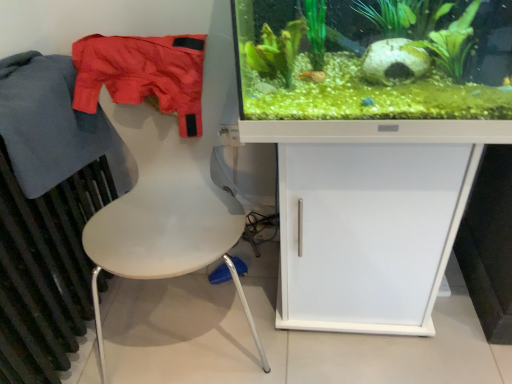
Question: Should I look upward or downward to see green matte plant at upper center?

Choices:
 (A) down
 (B) up

Answer: (B)

Question: Is white matte chair at left behind blue cotton jacket at left, the 1th clothing positioned from the left?

Choices:
 (A) yes
 (B) no

Answer: (B)

Question: Is white matte chair at left far away from blue cotton jacket at left, which appears as the 2th clothing when viewed from the right?

Choices:
 (A) yes
 (B) no

Answer: (B)

Question: From the image's perspective, does white matte chair at left appear lower than blue cotton jacket at left, the 1th clothing positioned from the left?

Choices:
 (A) no
 (B) yes

Answer: (B)

Question: Is white matte chair at left shorter than blue cotton jacket at left, the 1th clothing positioned from the left?

Choices:
 (A) yes
 (B) no

Answer: (B)

Question: Can you confirm if white matte chair at left is thinner than blue cotton jacket at left, the 1th clothing positioned from the left?

Choices:
 (A) yes
 (B) no

Answer: (B)

Question: Is the depth of white matte chair at left less than that of blue cotton jacket at left, the 1th clothing positioned from the left?

Choices:
 (A) no
 (B) yes

Answer: (B)

Question: Can you confirm if white matte cabinet at center is positioned to the right of dark gray metallic radiator at left?

Choices:
 (A) no
 (B) yes

Answer: (B)

Question: Considering the relative sizes of white matte cabinet at center and dark gray metallic radiator at left in the image provided, is white matte cabinet at center taller than dark gray metallic radiator at left?

Choices:
 (A) yes
 (B) no

Answer: (B)

Question: From the image's perspective, is white matte cabinet at center located above dark gray metallic radiator at left?

Choices:
 (A) yes
 (B) no

Answer: (A)

Question: From a real-world perspective, is white matte cabinet at center positioned under dark gray metallic radiator at left based on gravity?

Choices:
 (A) no
 (B) yes

Answer: (B)

Question: Is white matte cabinet at center oriented towards dark gray metallic radiator at left?

Choices:
 (A) yes
 (B) no

Answer: (B)

Question: Considering the relative sizes of white matte cabinet at center and dark gray metallic radiator at left in the image provided, is white matte cabinet at center shorter than dark gray metallic radiator at left?

Choices:
 (A) no
 (B) yes

Answer: (B)

Question: Can you confirm if blue cotton jacket at left, the 1th clothing positioned from the left, is bigger than white matte chair at left?

Choices:
 (A) yes
 (B) no

Answer: (B)